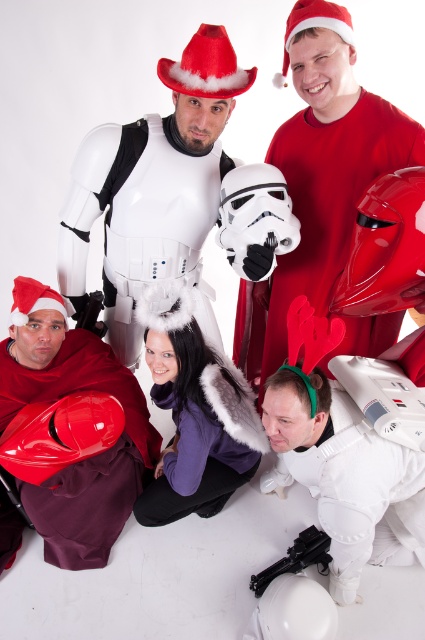
Question: Does matte red helmet at lower left have a lesser width compared to black plastic gun at lower center?

Choices:
 (A) yes
 (B) no

Answer: (B)

Question: Is red santa hat at upper center positioned at the back of black plastic gun at lower center?

Choices:
 (A) no
 (B) yes

Answer: (A)

Question: Which point is closer to the camera?

Choices:
 (A) (90, 292)
 (B) (351, 416)

Answer: (B)

Question: Which object is closer to the camera taking this photo?

Choices:
 (A) matte red helmet at lower left
 (B) red santa hat at upper center
 (C) matte black gun at lower left

Answer: (B)

Question: Which point is closer to the camera?

Choices:
 (A) red velvet santa hat at upper center
 (B) red santa hat at upper center
 (C) white matte stormtrooper armor at center
 (D) glossy plastic helmet at center

Answer: (A)

Question: Can you confirm if black plastic gun at lower center is positioned below red felt santa hat at lower left?

Choices:
 (A) no
 (B) yes

Answer: (B)